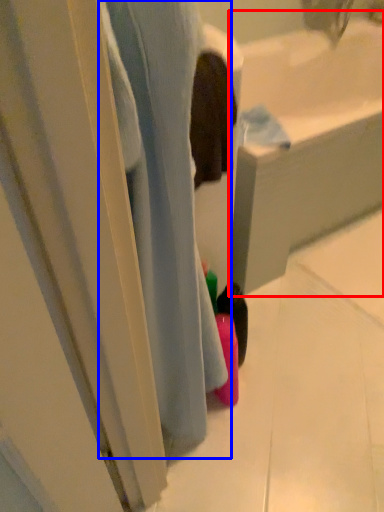
Question: Among these objects, which one is nearest to the camera, bath (highlighted by a red box) or bath (highlighted by a blue box)?

Choices:
 (A) bath
 (B) bath

Answer: (B)